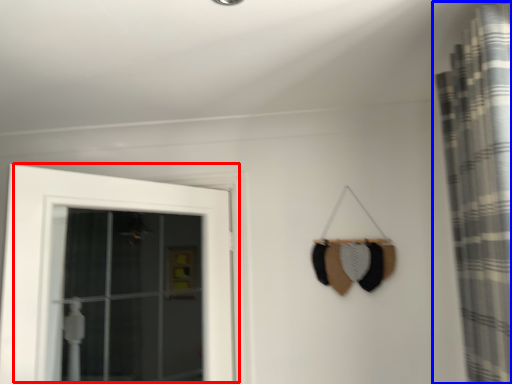
Question: Among these objects, which one is farthest to the camera, door (highlighted by a red box) or curtain (highlighted by a blue box)?

Choices:
 (A) door
 (B) curtain

Answer: (A)